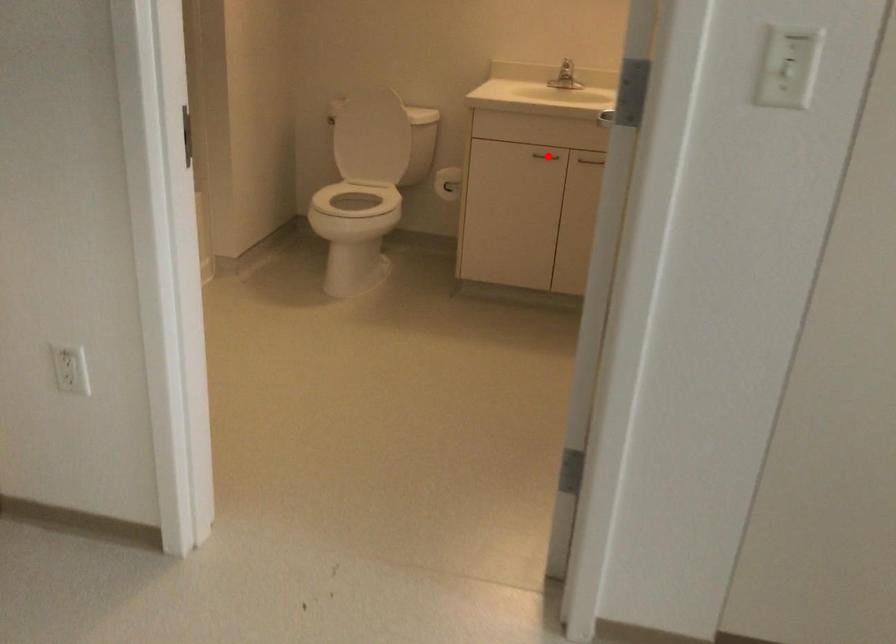
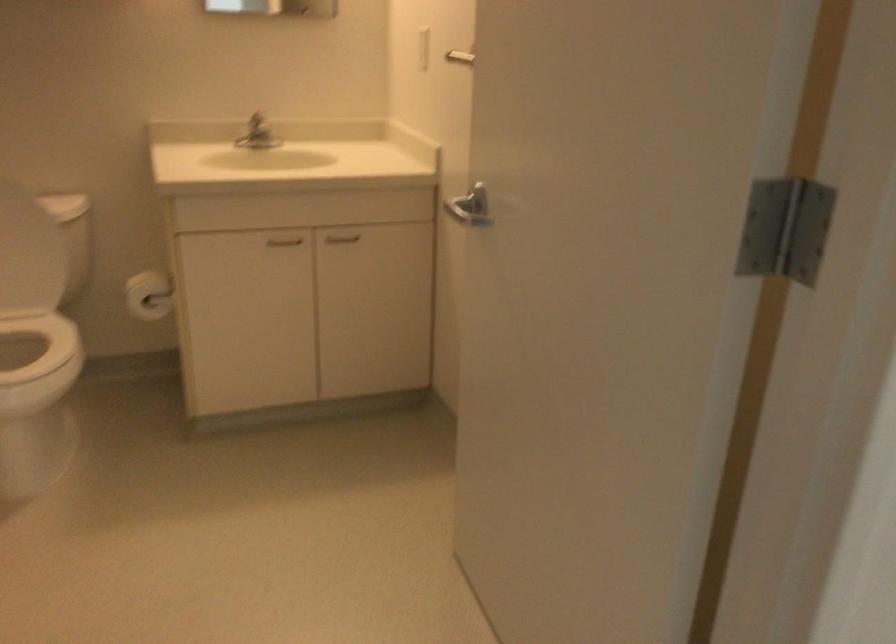
Locate, in the second image, the point that corresponds to the highlighted location in the first image.

(283, 241)